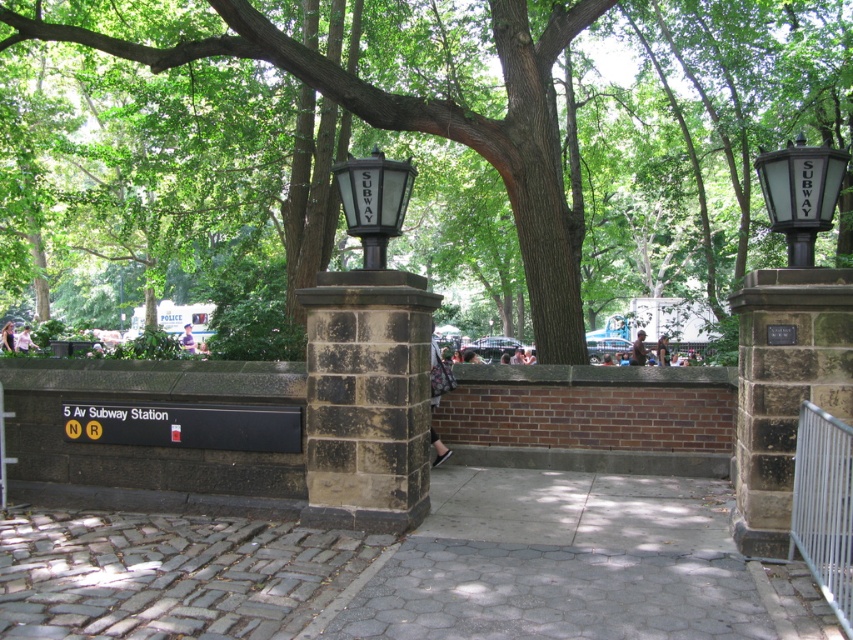
Question: Does matte black lamp post at center have a larger size compared to black glass street light at center?

Choices:
 (A) yes
 (B) no

Answer: (B)

Question: Among these points, which one is nearest to the camera?

Choices:
 (A) (784, 205)
 (B) (367, 193)
 (C) (577, 1)

Answer: (A)

Question: Based on their relative distances, which object is farther from the black glass street light at center?

Choices:
 (A) green leafy tree at center
 (B) gray cobblestone pavement at center
 (C) clear glass streetlight at upper right

Answer: (B)

Question: Is gray cobblestone pavement at center above matte black lamp post at center?

Choices:
 (A) no
 (B) yes

Answer: (A)

Question: Estimate the real-world distances between objects in this image. Which object is closer to the green leafy tree at center?

Choices:
 (A) black glass street light at center
 (B) matte black lamp post at center

Answer: (B)

Question: Does clear glass streetlight at upper right have a greater width compared to matte black lamp post at center?

Choices:
 (A) yes
 (B) no

Answer: (B)